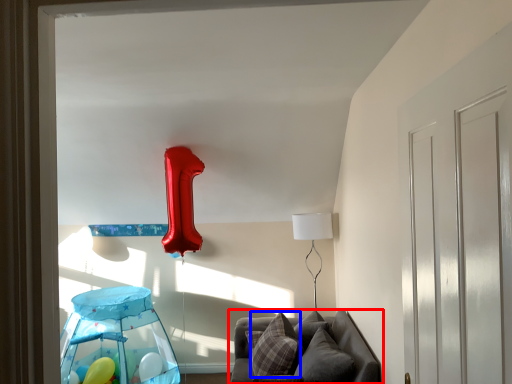
Question: Which point is closer to the camera, furniture (highlighted by a red box) or pillow (highlighted by a blue box)?

Choices:
 (A) furniture
 (B) pillow

Answer: (A)